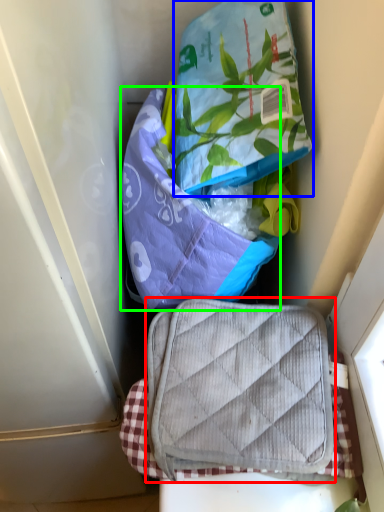
Question: Which object is the closest to the luggage and bags (highlighted by a red box)? Choose among these: pouch (highlighted by a blue box) or pouch (highlighted by a green box).

Choices:
 (A) pouch
 (B) pouch

Answer: (B)